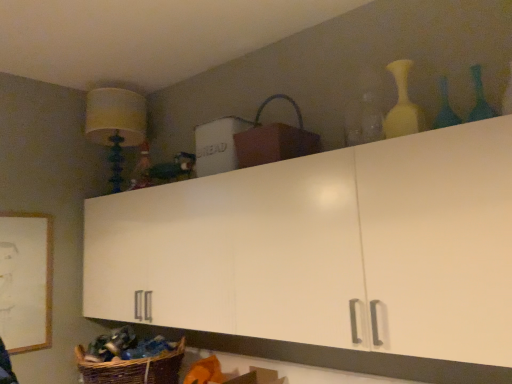
Question: Can you confirm if white wooden picture frame at lower left is taller than brown woven basket at upper center, which ranks as the first basket in right-to-left order?

Choices:
 (A) no
 (B) yes

Answer: (B)

Question: From the image's perspective, would you say white wooden picture frame at lower left is positioned over brown woven basket at upper center, which is the second basket from left to right?

Choices:
 (A) no
 (B) yes

Answer: (A)

Question: Does white wooden picture frame at lower left appear on the right side of brown woven basket at upper center, which is the second basket from left to right?

Choices:
 (A) yes
 (B) no

Answer: (B)

Question: Is white wooden picture frame at lower left facing towards brown woven basket at upper center, acting as the 2th basket starting from the bottom?

Choices:
 (A) yes
 (B) no

Answer: (B)

Question: Is white wooden picture frame at lower left shorter than brown woven basket at upper center, arranged as the first basket when viewed from the top?

Choices:
 (A) yes
 (B) no

Answer: (B)

Question: Is white wooden picture frame at lower left not near brown woven basket at upper center, arranged as the first basket when viewed from the top?

Choices:
 (A) no
 (B) yes

Answer: (B)

Question: From the image's perspective, is blue glass bottle at upper right, marked as the 2th bottle in a left-to-right arrangement, located above matte yellow vase at upper right, the third bottle when ordered from right to left?

Choices:
 (A) yes
 (B) no

Answer: (B)

Question: Considering the relative positions of blue glass bottle at upper right, acting as the 2th bottle starting from the right, and matte yellow vase at upper right, the 1th bottle from the left, in the image provided, is blue glass bottle at upper right, acting as the 2th bottle starting from the right, to the left of matte yellow vase at upper right, the 1th bottle from the left, from the viewer's perspective?

Choices:
 (A) no
 (B) yes

Answer: (A)

Question: Is blue glass bottle at upper right, marked as the 2th bottle in a left-to-right arrangement, at the right side of matte yellow vase at upper right, the third bottle when ordered from right to left?

Choices:
 (A) yes
 (B) no

Answer: (A)

Question: Can you confirm if blue glass bottle at upper right, marked as the 2th bottle in a left-to-right arrangement, is smaller than matte yellow vase at upper right, the third bottle when ordered from right to left?

Choices:
 (A) yes
 (B) no

Answer: (A)

Question: From the image's perspective, is blue glass bottle at upper right, acting as the 2th bottle starting from the right, below matte yellow vase at upper right, the third bottle when ordered from right to left?

Choices:
 (A) no
 (B) yes

Answer: (B)

Question: Is blue glass bottle at upper right, acting as the 2th bottle starting from the right, surrounding matte yellow vase at upper right, the third bottle when ordered from right to left?

Choices:
 (A) yes
 (B) no

Answer: (B)

Question: Is woven brown basket at lower left, the second basket in the top-to-bottom sequence, directly adjacent to green glass bottle at upper right, the 3th bottle positioned from the left?

Choices:
 (A) no
 (B) yes

Answer: (A)